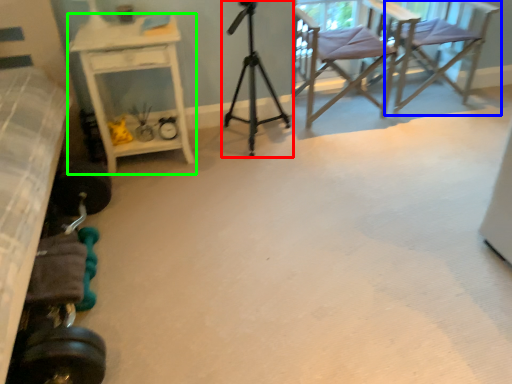
Question: Based on their relative distances, which object is nearer to tripod (highlighted by a red box)? Choose from chair (highlighted by a blue box) and desk (highlighted by a green box).

Choices:
 (A) chair
 (B) desk

Answer: (B)